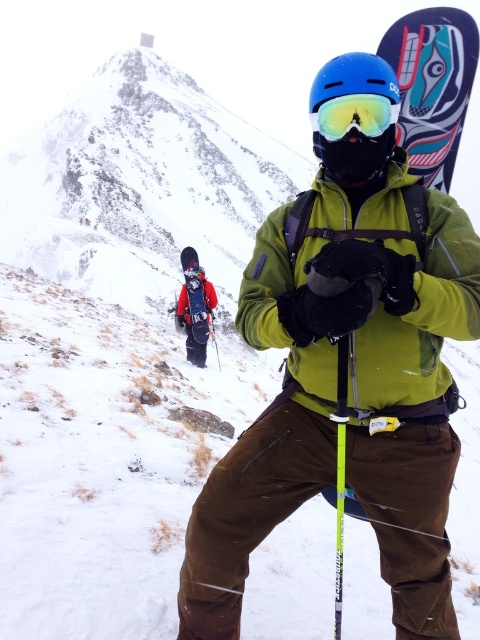
Does dark blue painted wood snowboard at center appear on the left side of green reflective lens goggles at center?

In fact, dark blue painted wood snowboard at center is to the right of green reflective lens goggles at center.

Between point (392, 42) and point (337, 113), which one is positioned in front?

Positioned in front is point (337, 113).

Where is `dark blue painted wood snowboard at center`? The image size is (480, 640). dark blue painted wood snowboard at center is located at coordinates (432, 86).

From the picture: Does green matte jacket at center appear under green reflective lens goggles at center?

Yes, green matte jacket at center is below green reflective lens goggles at center.

Is point (351, 76) less distant than point (364, 106)?

Yes, it is.

Describe the element at coordinates (357, 387) in the screenshot. Image resolution: width=480 pixels, height=640 pixels. I see `green matte jacket at center` at that location.

The width and height of the screenshot is (480, 640). In order to click on green matte jacket at center in this screenshot , I will do `click(357, 387)`.

Between green reflective lens goggles at center and matte black snowboard at center, which one has less height?

With less height is green reflective lens goggles at center.

Can you confirm if green reflective lens goggles at center is shorter than matte black snowboard at center?

Yes, green reflective lens goggles at center is shorter than matte black snowboard at center.

Does point (374, 122) come behind point (207, 321)?

No, it is not.

Image resolution: width=480 pixels, height=640 pixels. In order to click on green reflective lens goggles at center in this screenshot , I will do `click(354, 115)`.